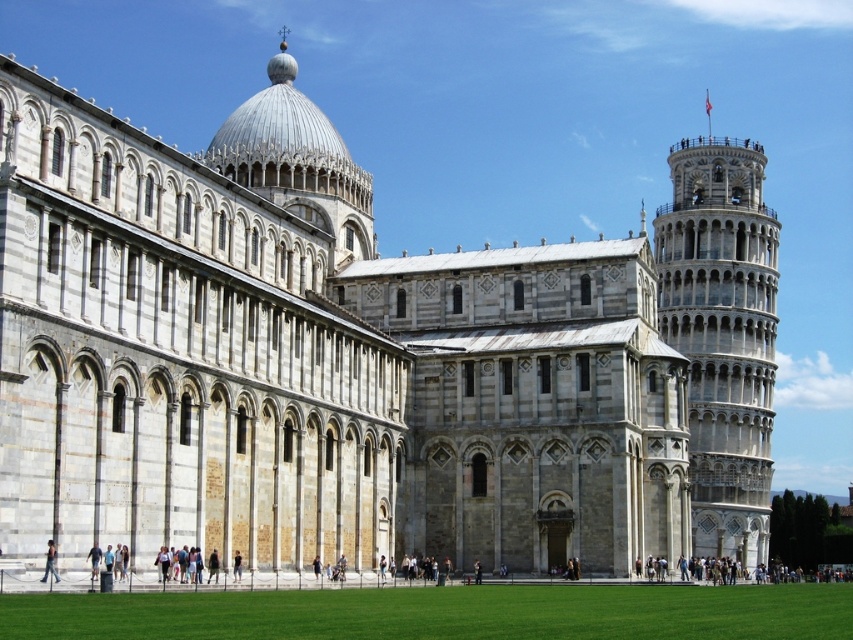
You are standing in the Piazza dei Miracoli and want to take a photo of the light gray stone tower at right. If you are currently at the center of the square, which direction should you move to frame the tower in your camera? Please provide your answer based on the coordinates provided in the scene description.

The light gray stone tower at right is located at coordinates point (722,333). Since you are at the center, you should move towards the northeast direction to frame it properly.

You are a tourist standing in the Piazza dei Miracoli and want to take a photo of both the light gray stone tower at right and the light brown leather jacket at lower left. Considering their sizes, which object should you focus on first to ensure both are in frame?

The light gray stone tower at right is taller than the light brown leather jacket at lower left, so you should focus on including the light gray stone tower at right first to ensure both are in frame.